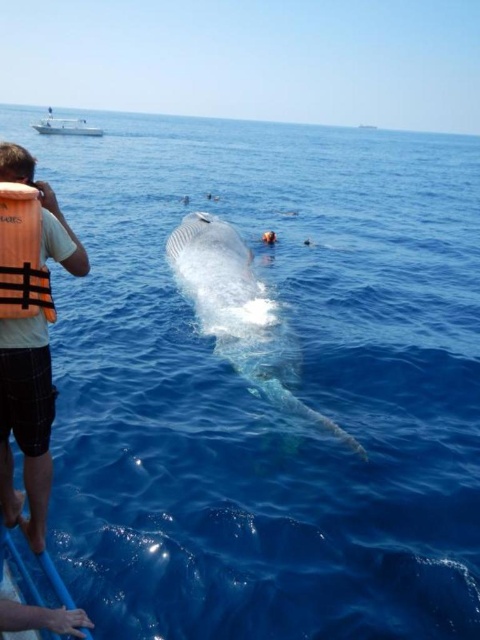
You are on a boat observing a whale breaching the water. There are two points marked in the image. The first point is at coordinate point (213, 230) and the second is at point (75, 122). From your position on the boat, which point is closer to you?

Point (213, 230) is in front of point (75, 122), so from your position on the boat, point (213, 230) is closer to you.

You are on a boat and want to take a photo of the gray matte whale at center. You have a camera in your hand. Where should you move to in relation to the orange fabric life jacket at left to get a clear shot of the whale?

You should move to the right of the orange fabric life jacket at left to get a clear shot of the gray matte whale at center since the whale is positioned to the right of the life jacket.